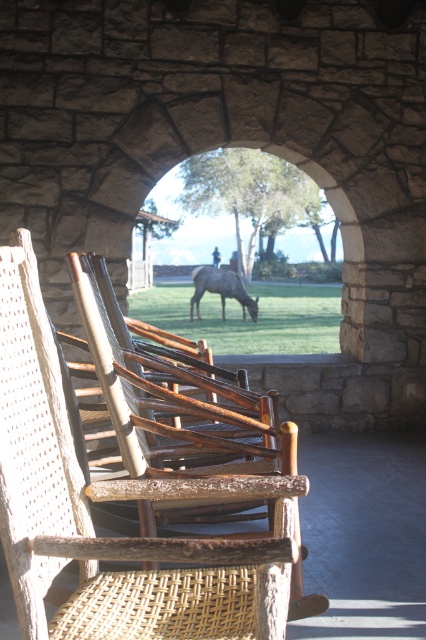
Question: Which object is closer to the camera taking this photo?

Choices:
 (A) brown textured horse at center
 (B) woven wood beach chair at center

Answer: (B)

Question: Which object is farther from the camera taking this photo?

Choices:
 (A) woven wood beach chair at center
 (B) brown textured horse at center

Answer: (B)

Question: Is woven wood beach chair at center to the right of brown textured horse at center from the viewer's perspective?

Choices:
 (A) yes
 (B) no

Answer: (A)

Question: Does woven wood beach chair at center lie in front of brown textured horse at center?

Choices:
 (A) yes
 (B) no

Answer: (A)

Question: Is woven wood beach chair at center thinner than brown textured horse at center?

Choices:
 (A) no
 (B) yes

Answer: (B)